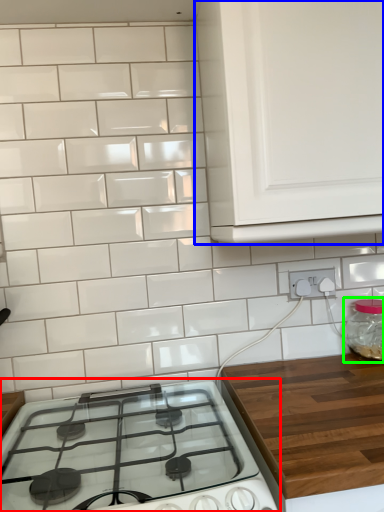
Question: Which object is positioned closest to gas stove (highlighted by a red box)? Select from cabinetry (highlighted by a blue box) and glass jar (highlighted by a green box).

Choices:
 (A) cabinetry
 (B) glass jar

Answer: (A)